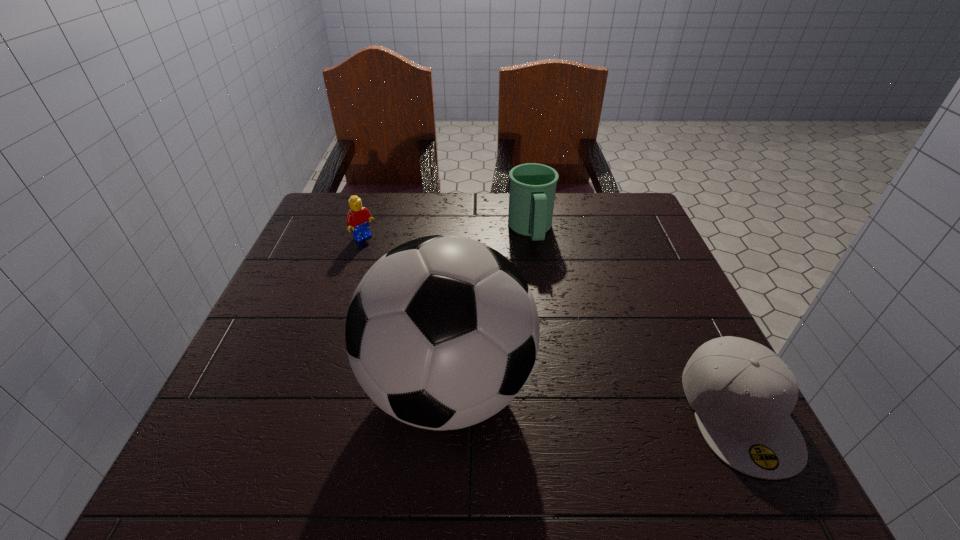
Image resolution: width=960 pixels, height=540 pixels. What are the coordinates of `vacant spot on the desktop that is between the soccer ball and the cap and is positioned on the front-facing side of the second shortest object` in the screenshot? It's located at (556, 395).

You are a GUI agent. You are given a task and a screenshot of the screen. Output one action in this format:
    pyautogui.click(x=<x>, y=<y>)
    Task: Click on the free space on the desktop that is between the soccer ball and the cap and is positioned on the side of the third shortest object with the handle
    Image resolution: width=960 pixels, height=540 pixels.
    Given the screenshot: What is the action you would take?
    pyautogui.click(x=580, y=397)